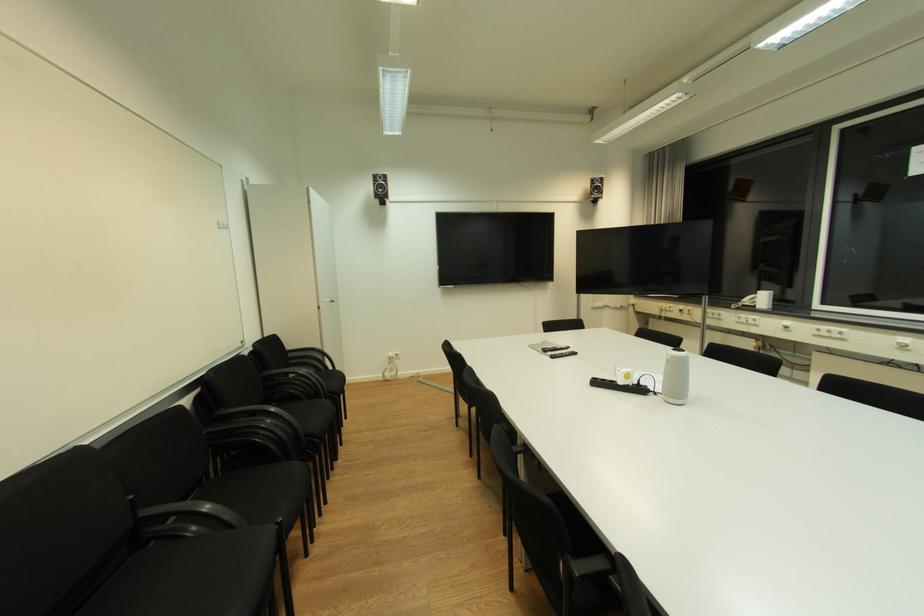
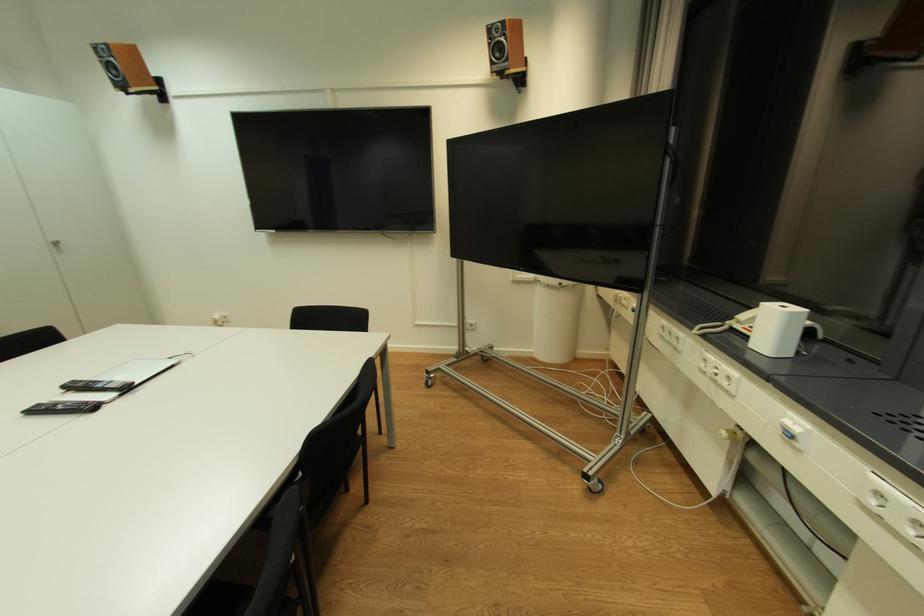
Where in the second image is the point corresponding to pixel 335 304 from the first image?

(57, 246)